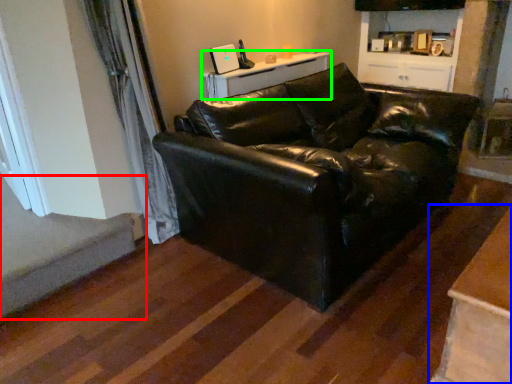
Question: Which object is the farthest from stairwell (highlighted by a red box)? Choose among these: table (highlighted by a blue box) or table (highlighted by a green box).

Choices:
 (A) table
 (B) table

Answer: (A)